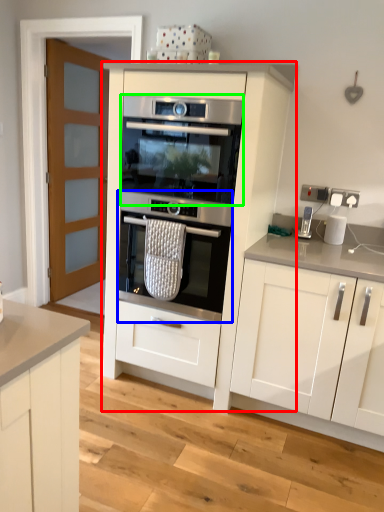
Question: Which is nearer to the cabinetry (highlighted by a red box)? oven (highlighted by a blue box) or oven (highlighted by a green box).

Choices:
 (A) oven
 (B) oven

Answer: (A)